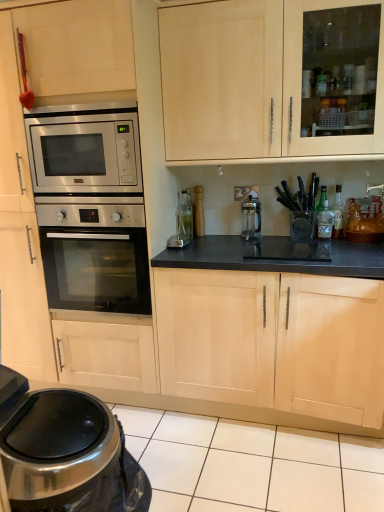
Find the location of `vacant space situated on the left part of clear glass bottle at center-right, the third bottle when ordered from right to left`. vacant space situated on the left part of clear glass bottle at center-right, the third bottle when ordered from right to left is located at coordinates (305, 234).